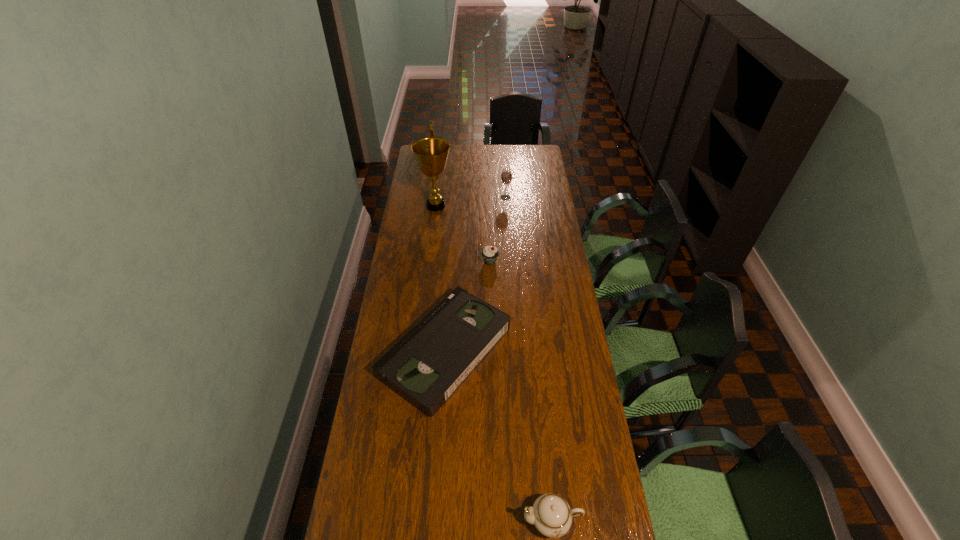
Identify the location of the tallest object. The width and height of the screenshot is (960, 540). (431, 153).

Locate an element on the screen. Image resolution: width=960 pixels, height=540 pixels. wineglass is located at coordinates (506, 175).

The height and width of the screenshot is (540, 960). I want to click on the third nearest object, so click(490, 254).

Find the location of a particular element. the shortest object is located at coordinates pyautogui.click(x=431, y=361).

This screenshot has height=540, width=960. Identify the location of the second nearest object. (431, 361).

Identify the location of free space located on the front view with handles of the award. (492, 206).

You are a GUI agent. You are given a task and a screenshot of the screen. Output one action in this format:
    pyautogui.click(x=<x>, y=<y>)
    Task: Click on the free space located 0.170m on the back of the wineglass
    
    Given the screenshot: What is the action you would take?
    pyautogui.click(x=504, y=176)

Image resolution: width=960 pixels, height=540 pixels. What are the coordinates of `free location located on the right of the third farthest object` in the screenshot? It's located at (524, 262).

At what (x,y) coordinates should I click in order to perform the action: click on vacant region located on the back of the shortest object. Please return your answer as a coordinate pair (x, y). Image resolution: width=960 pixels, height=540 pixels. Looking at the image, I should click on (452, 241).

In order to click on award positioned at the left edge in this screenshot , I will do `click(431, 153)`.